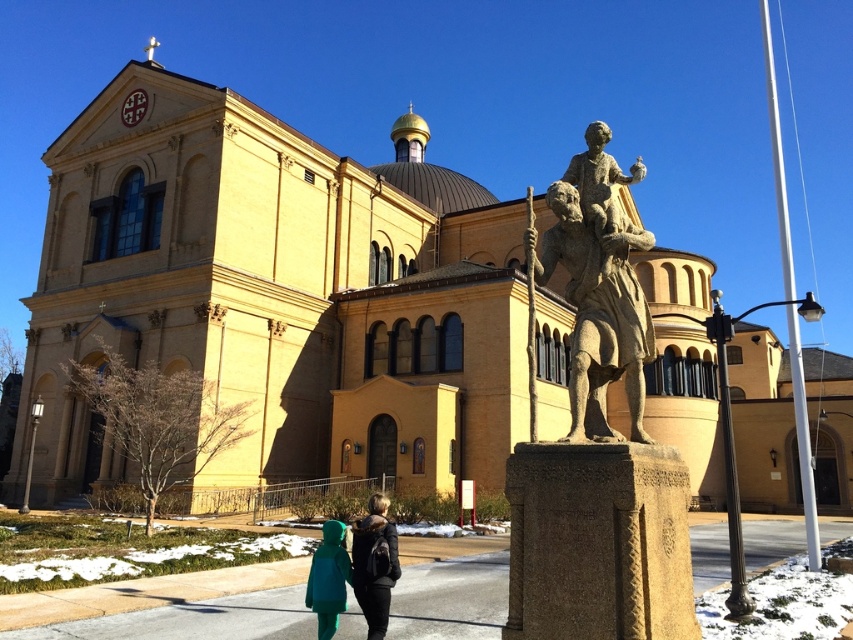
Question: Does stone statue at center have a smaller size compared to green matte jacket at lower center?

Choices:
 (A) yes
 (B) no

Answer: (B)

Question: Which of the following is the farthest from the observer?

Choices:
 (A) teal fabric coat at lower left
 (B) green matte jacket at lower center

Answer: (B)

Question: Which point appears farthest from the camera in this image?

Choices:
 (A) (631, 403)
 (B) (328, 600)

Answer: (B)

Question: Estimate the real-world distances between objects in this image. Which object is closer to the stone statue at center?

Choices:
 (A) green matte jacket at lower center
 (B) teal fabric coat at lower left

Answer: (B)

Question: Can you confirm if teal fabric coat at lower left is smaller than green matte jacket at lower center?

Choices:
 (A) no
 (B) yes

Answer: (A)

Question: Is the position of stone statue at center more distant than that of teal fabric coat at lower left?

Choices:
 (A) yes
 (B) no

Answer: (B)